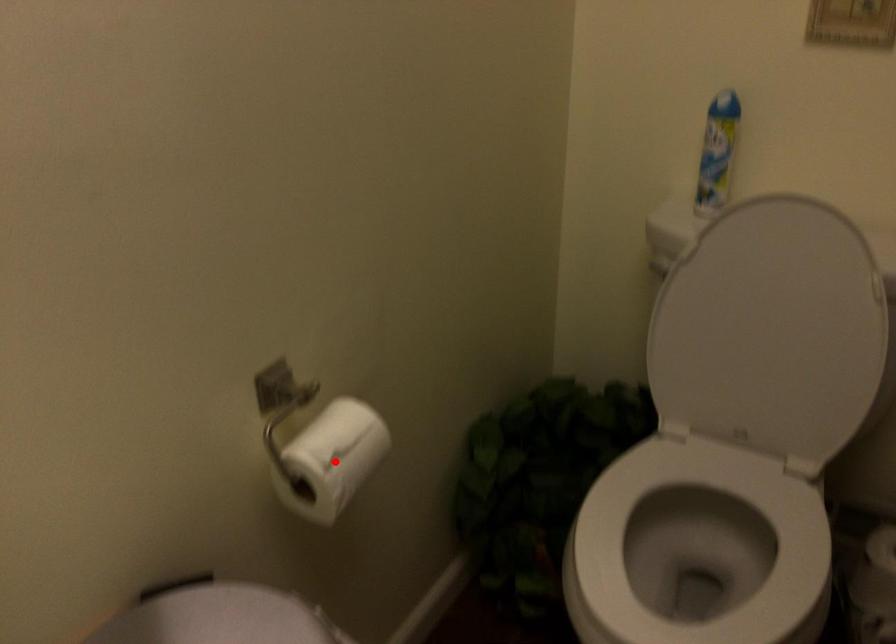
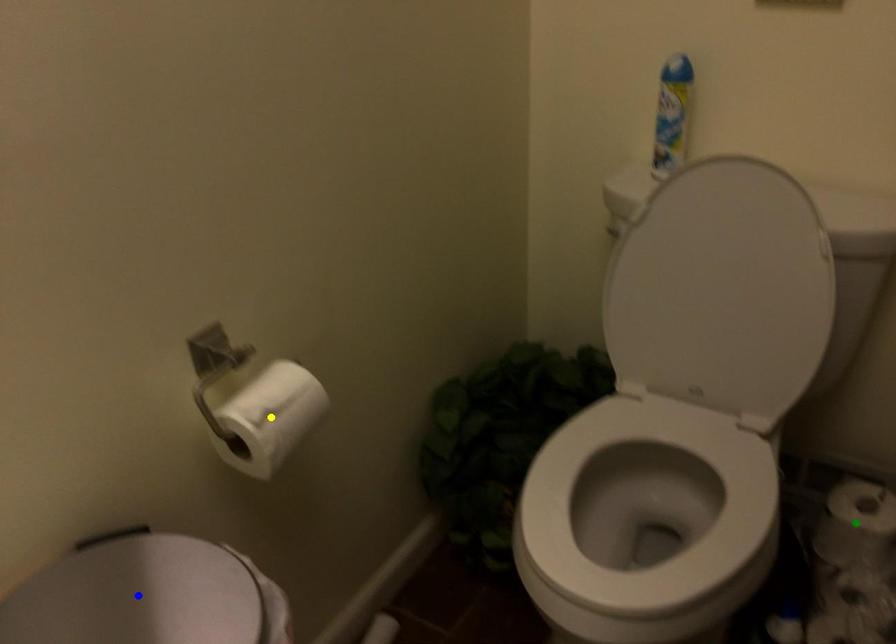
Question: I am providing you with two images of the same scene from different viewpoints. A red point is marked on the first image. You are given multiple points on the second image. Which spot in image 2 lines up with the point in image 1?

Choices:
 (A) blue point
 (B) green point
 (C) yellow point

Answer: (C)